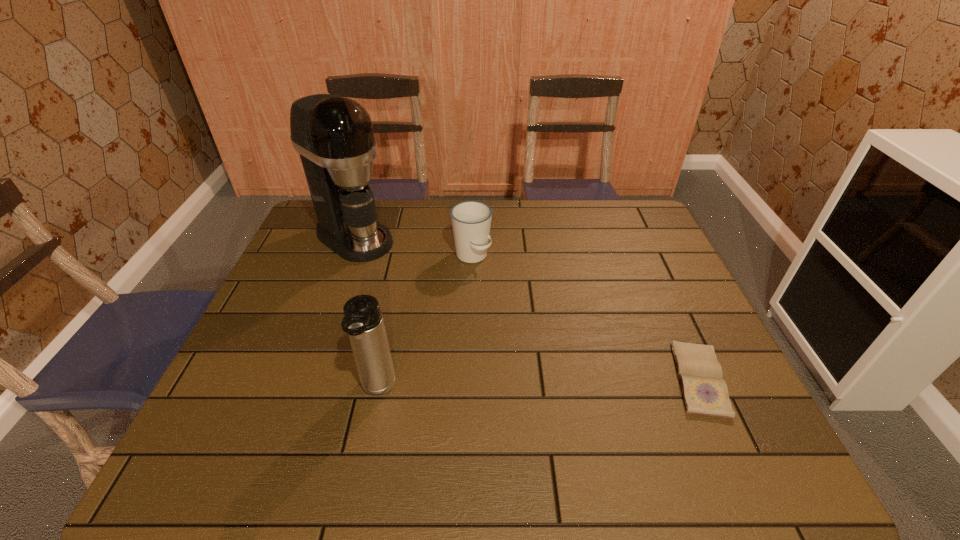
The image size is (960, 540). What are the coordinates of `object that is at the far left corner` in the screenshot? It's located at (334, 136).

Where is `object located in the near right corner section of the desktop`? The image size is (960, 540). object located in the near right corner section of the desktop is located at coordinates (704, 391).

Locate an element on the screen. This screenshot has width=960, height=540. vacant point at the far edge is located at coordinates (409, 201).

Locate an element on the screen. The image size is (960, 540). free space at the near edge of the desktop is located at coordinates (340, 396).

Where is `vacant space at the left edge of the desktop`? The height and width of the screenshot is (540, 960). vacant space at the left edge of the desktop is located at coordinates (306, 272).

Image resolution: width=960 pixels, height=540 pixels. I want to click on blank area at the right edge, so click(668, 351).

The height and width of the screenshot is (540, 960). I want to click on free space between the cup and the leftmost object, so click(x=413, y=247).

This screenshot has height=540, width=960. What are the coordinates of `unoccupied area between the leftmost object and the diary` in the screenshot? It's located at (527, 308).

In order to click on unoccupied area between the second object from left to right and the rightmost object in this screenshot , I will do `click(539, 384)`.

At what (x,y) coordinates should I click in order to perform the action: click on blank region between the tallest object and the second object from right to left. Please return your answer as a coordinate pair (x, y). The height and width of the screenshot is (540, 960). Looking at the image, I should click on tap(413, 247).